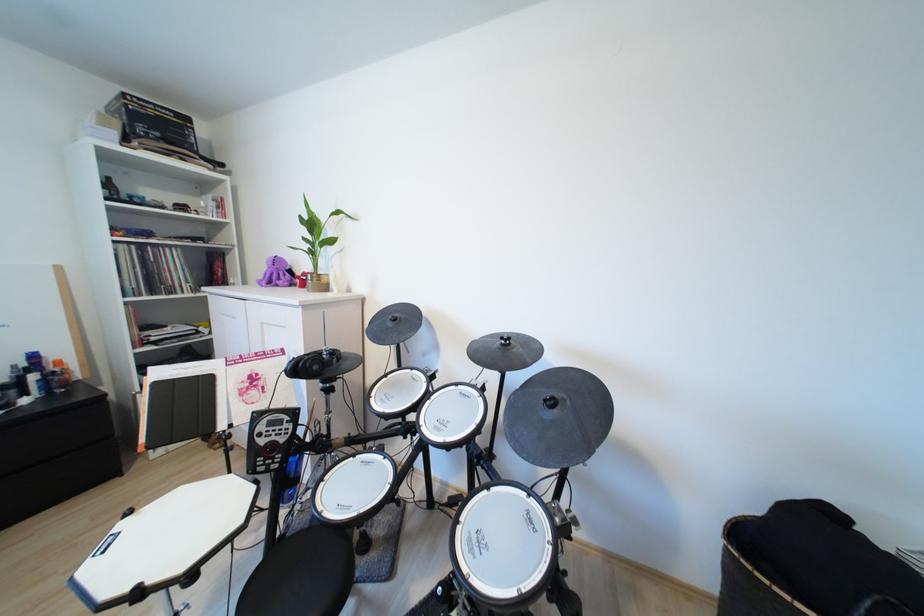
At what (x,y) coordinates should I click in order to perform the action: click on black headphones. Please return your answer as a coordinate pair (x, y). Looking at the image, I should click on (311, 363).